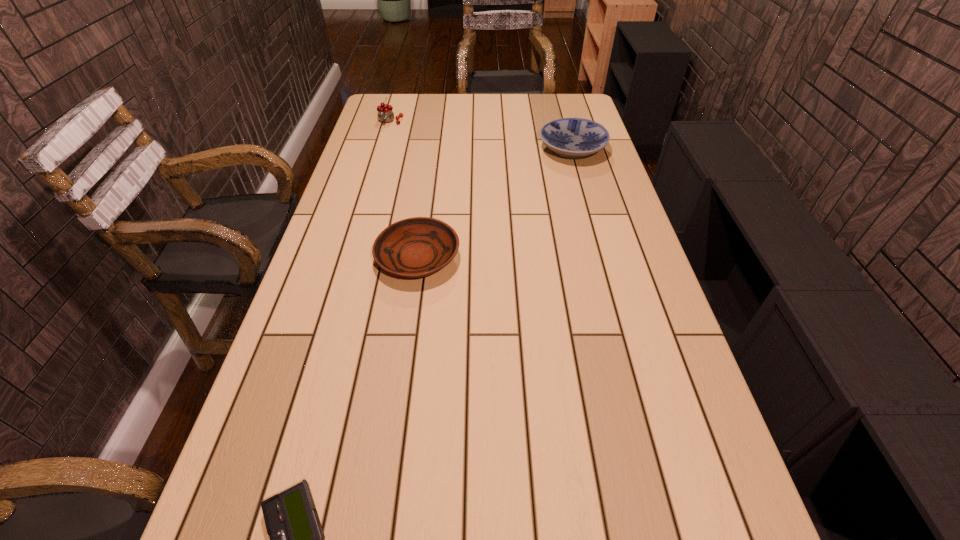
Identify which object is located as the third nearest to the left plate. Please provide its 2D coordinates. Your answer should be formatted as a tuple, i.e. [(x, y)], where the tuple contains the x and y coordinates of a point satisfying the conditions above.

[(385, 114)]

Locate an element on the screen. Image resolution: width=960 pixels, height=540 pixels. vacant area that satisfies the following two spatial constraints: 1. on the handle side of the third tallest object; 2. on the right side of the farthest object is located at coordinates (349, 258).

The image size is (960, 540). In order to click on vacant area in the image that satisfies the following two spatial constraints: 1. on the handle side of the farthest object; 2. on the left side of the nearer plate in this screenshot , I will do `click(349, 258)`.